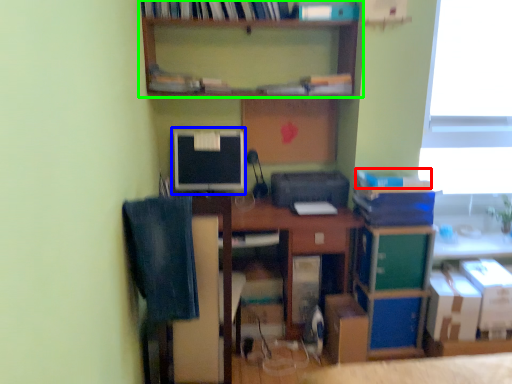
Question: Considering the real-world distances, which object is closest to book (highlighted by a red box)? computer monitor (highlighted by a blue box) or shelf (highlighted by a green box).

Choices:
 (A) computer monitor
 (B) shelf

Answer: (B)